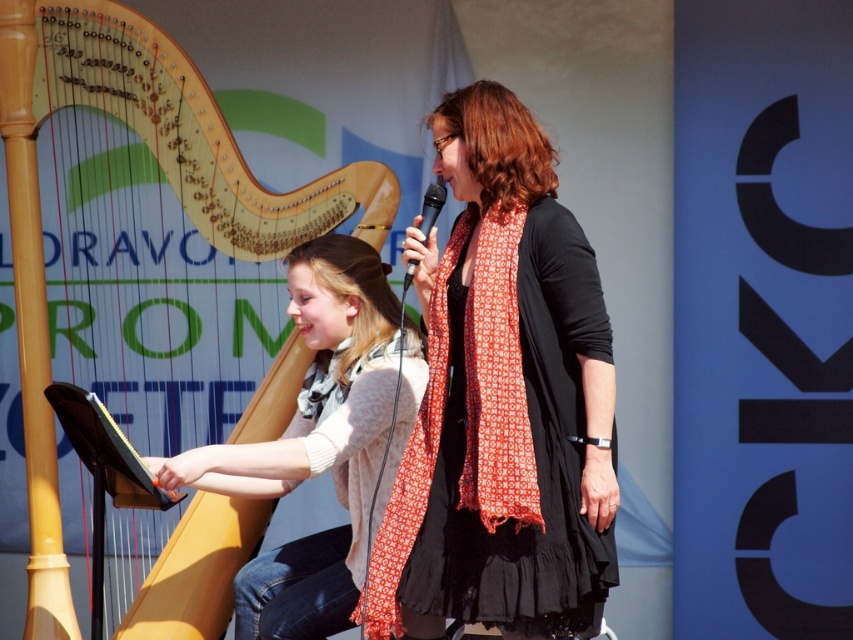
You are a photographer positioned at the center of the stage. You want to capture a closeup shot of the wooden harp at left without moving your camera. Can you do it?

The wooden harp at left is 5.56 meters away from viewer. Since the photographer is at the center of the stage and the harp is 5.56 meters away, a closeup shot would require a zoom lens capable of focusing at that distance. Without moving the camera, it depends on the lens capabilities, but the distance itself is feasible for a closeup if the equipment allows.

You are a photographer at the event and want to capture a photo of both the wooden harp at left and the orange printed scarf at center. Which object should you focus on first to ensure both are in the frame?

The wooden harp at left is located above the orange printed scarf at center, so you should focus on the wooden harp at left first to ensure both are in the frame.